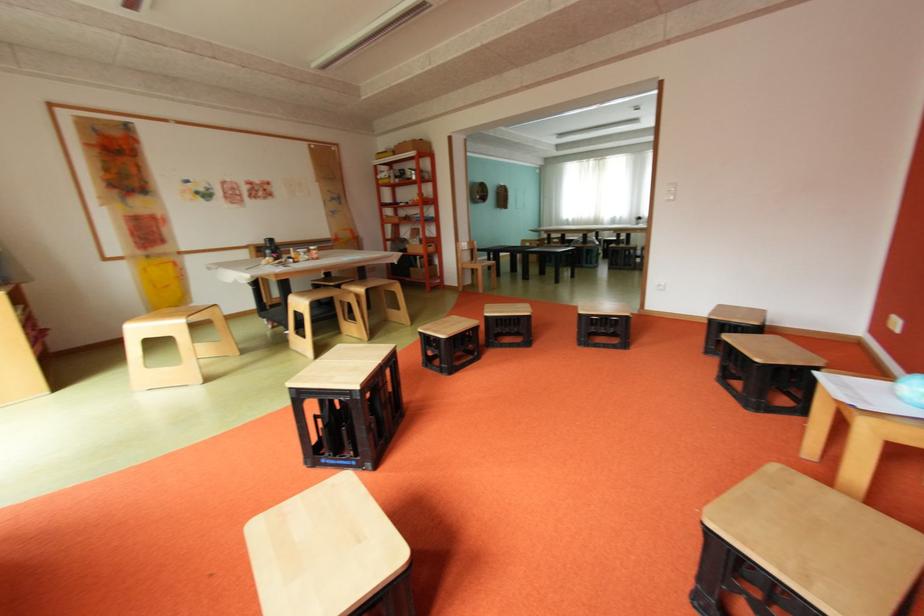
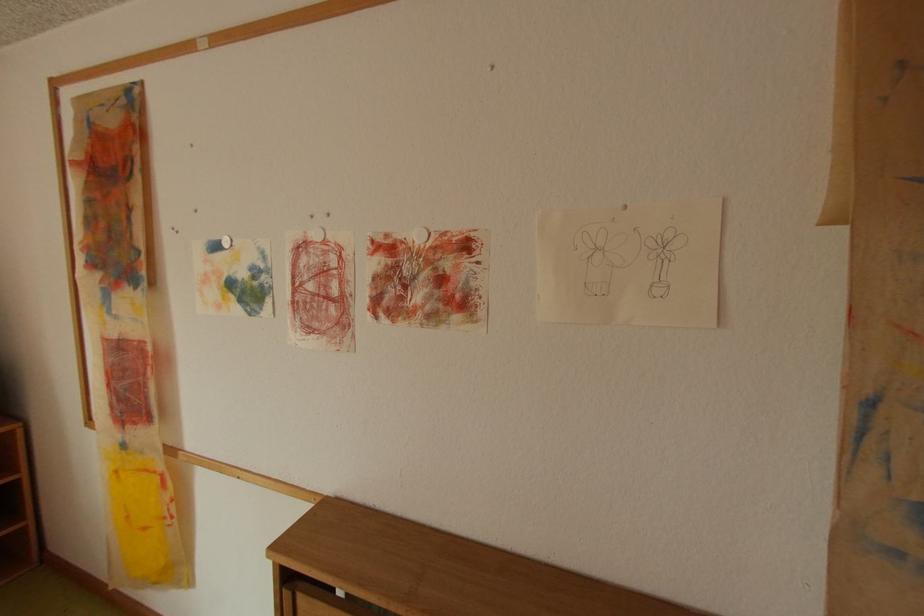
In the second image, find the point that corresponds to [198,182] in the first image.

(225, 246)